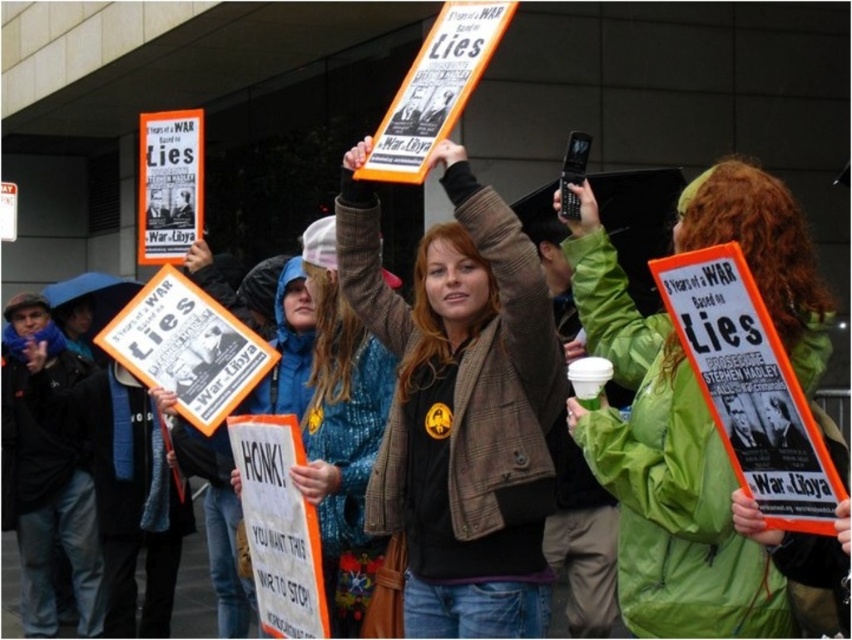
You are a photographer trying to capture a clear shot of both the matte orange sign at center and the green waterproof jacket at center. Given their sizes, which object should you focus on first to ensure it fits within your camera frame?

The matte orange sign at center is wider than the green waterproof jacket at center. To ensure both fit in the frame, focus on positioning the wider matte orange sign at center first, then adjust to include the smaller green waterproof jacket at center.

You are a photographer at the protest. You want to take a photo that clearly shows both the matte orange sign at center and the green waterproof jacket at center. Which object should you focus on to ensure both are in frame?

The matte orange sign at center is bigger than the green waterproof jacket at center. To ensure both are in frame, focus on the matte orange sign at center as it is larger and will be easier to position within the camera view.

You are a photographer at the protest. You want to take a photo of the matte orange sign at center without any obstructions. Given that the green waterproof jacket at center is in the way, can you move around the sign to get a clear shot?

The green waterproof jacket at center is behind the matte orange sign at center, so moving around the sign might allow you to position yourself where the jacket is no longer blocking the view. However, since the jacket is behind the sign, it might already not obstruct the front view of the sign. You can take the photo from the front without needing to move around the sign.